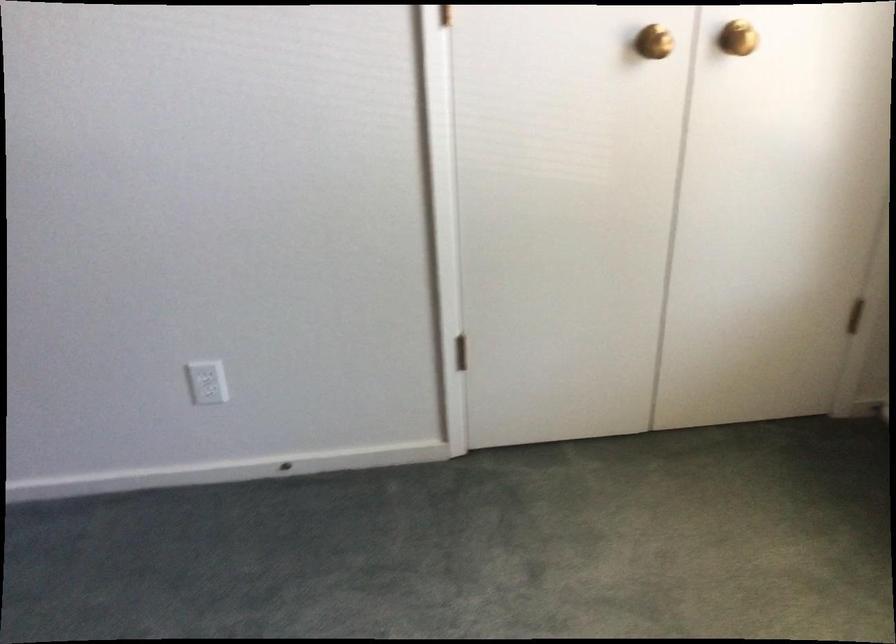
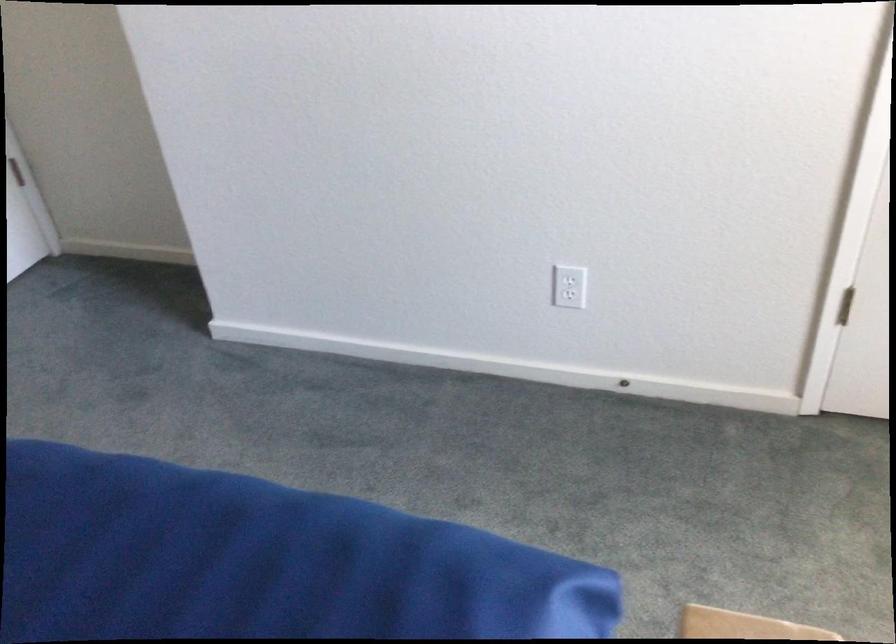
Find the pixel in the second image that matches [207,391] in the first image.

(569, 295)